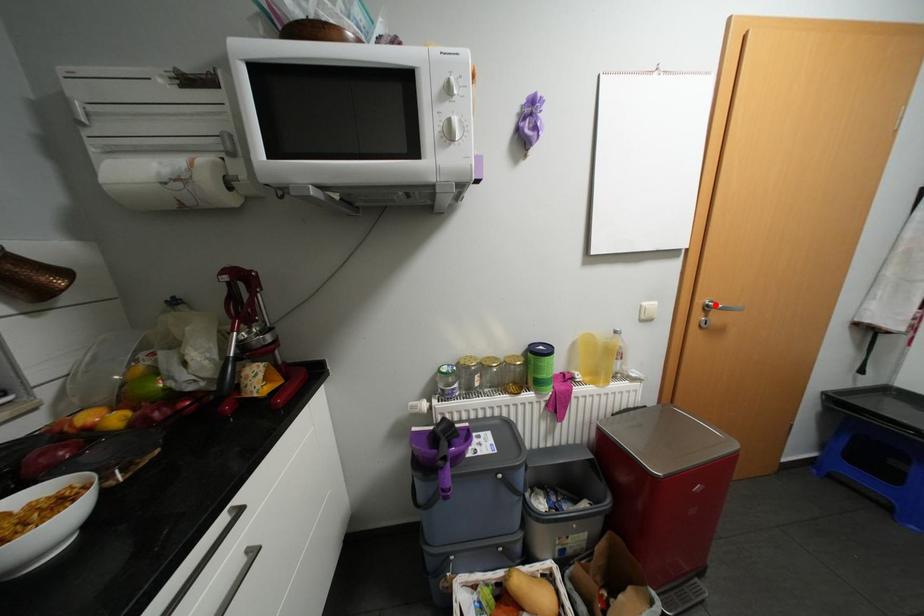
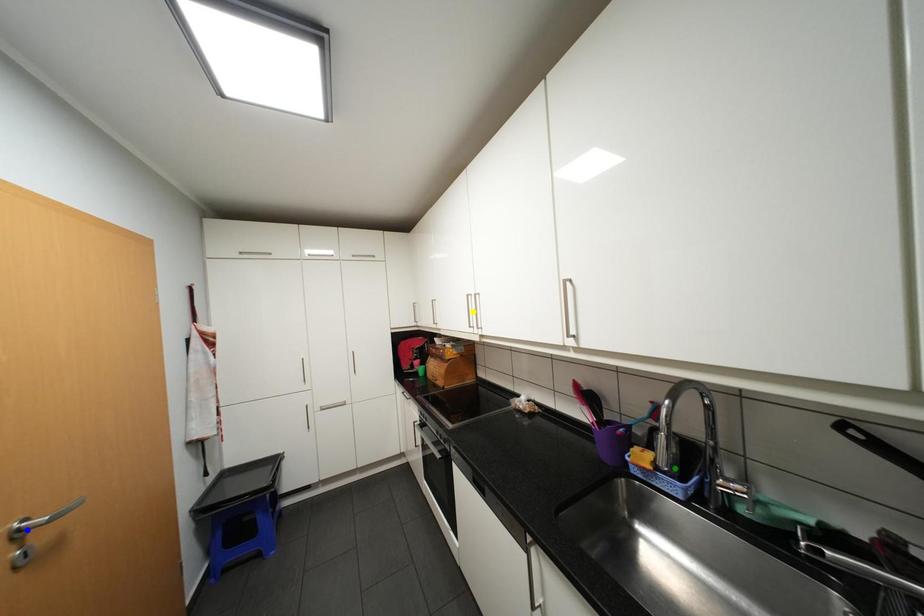
Question: I am providing you with two images of the same scene from different viewpoints. A red point is marked on the first image. You are given multiple points on the second image. Which point in image 2 represents the same 3d spot as the red point in image 1?

Choices:
 (A) yellow point
 (B) blue point
 (C) green point

Answer: (B)